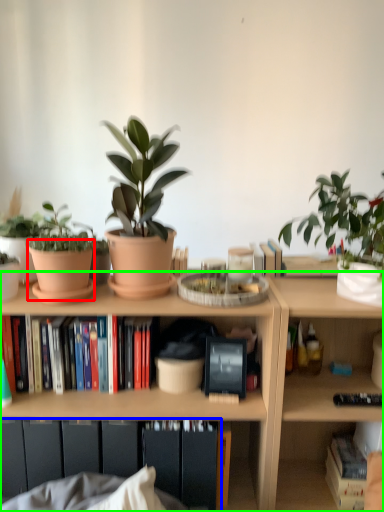
Question: Which object is the closest to the flowerpot (highlighted by a red box)? Choose among these: cabinet (highlighted by a blue box) or bookcase (highlighted by a green box).

Choices:
 (A) cabinet
 (B) bookcase

Answer: (B)